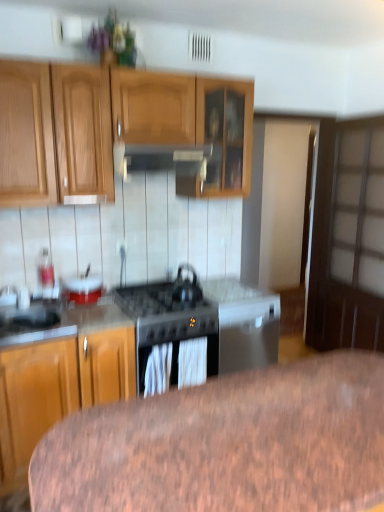
Question: Does point (66, 281) appear closer or farther from the camera than point (215, 308)?

Choices:
 (A) farther
 (B) closer

Answer: (A)

Question: From a real-world perspective, is white glossy bowl at center-left above or below black matte gas stove at center?

Choices:
 (A) above
 (B) below

Answer: (A)

Question: Estimate the real-world distances between objects in this image. Which object is farther from the white glossy bowl at center-left?

Choices:
 (A) satin silver sink at lower left
 (B) black matte kettle at center
 (C) brown wood table at lower center
 (D) satin silver exhaust hood at upper center
 (E) black matte gas stove at center

Answer: (C)

Question: Estimate the real-world distances between objects in this image. Which object is closer to the black matte kettle at center?

Choices:
 (A) brown wood table at lower center
 (B) satin silver exhaust hood at upper center
 (C) white glossy bowl at center-left
 (D) black matte gas stove at center
 (E) satin silver sink at lower left

Answer: (D)